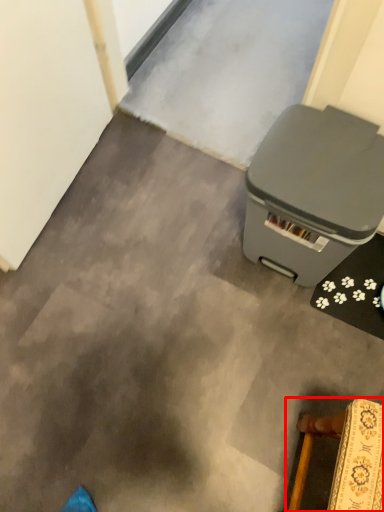
Question: From the image, what is the correct spatial relationship of furniture (annotated by the red box) in relation to waste container?

Choices:
 (A) left
 (B) right

Answer: (B)